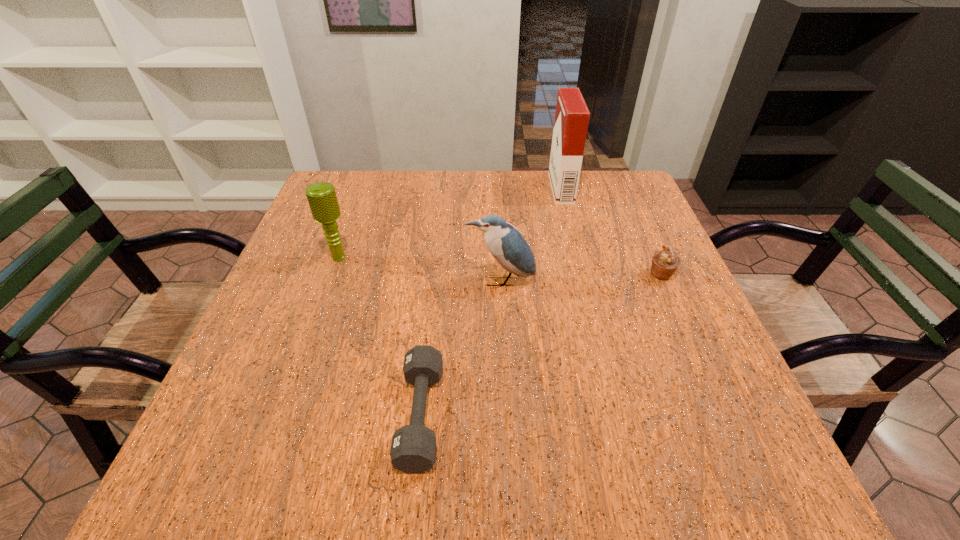
Where is `vacant area in the image that satisfies the following two spatial constraints: 1. on the front-facing side of the tallest object; 2. at the tip of the third object from left to right's beak`? Image resolution: width=960 pixels, height=540 pixels. vacant area in the image that satisfies the following two spatial constraints: 1. on the front-facing side of the tallest object; 2. at the tip of the third object from left to right's beak is located at coordinates (585, 281).